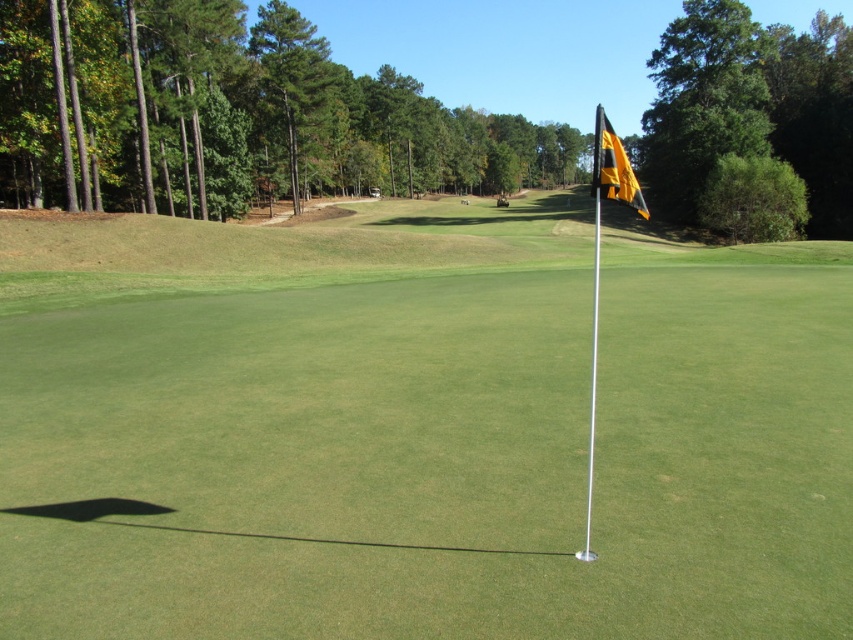
You are a golfer standing at the tee, aiming to hit your ball towards the metallic flag at center on the putting green. If the flag is located at coordinates approximately 0.669 on the x axis and 0.492 on the y axis, which direction should you aim your shot relative to your current position?

The metallic flag at center is positioned at coordinates approximately 0.669 on the x axis and 0.492 on the y axis. To aim your shot, you should direct your ball towards the center of the putting green, where the flag is located.